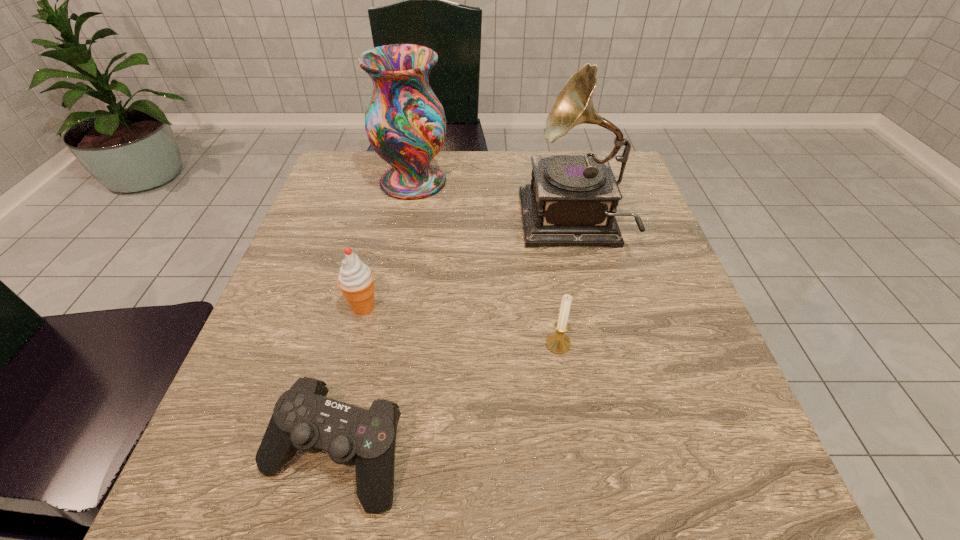
The image size is (960, 540). I want to click on record player, so click(x=572, y=200).

The width and height of the screenshot is (960, 540). I want to click on vase, so click(x=405, y=122).

Identify the location of the third tallest object. The width and height of the screenshot is (960, 540). (356, 280).

Locate an element on the screen. Image resolution: width=960 pixels, height=540 pixels. the third nearest object is located at coordinates (356, 280).

I want to click on the second shortest object, so click(x=558, y=342).

At what (x,y) coordinates should I click in order to perform the action: click on candle holder. Please return your answer as a coordinate pair (x, y). Looking at the image, I should click on (558, 342).

Find the location of a particular element. The width and height of the screenshot is (960, 540). the shortest object is located at coordinates (304, 419).

Find the location of a particular element. The height and width of the screenshot is (540, 960). the nearest object is located at coordinates (304, 419).

Where is `free space located on the horn of the record player`? Image resolution: width=960 pixels, height=540 pixels. free space located on the horn of the record player is located at coordinates (385, 225).

This screenshot has height=540, width=960. What are the coordinates of `vacant space located on the horn of the record player` in the screenshot? It's located at tap(479, 225).